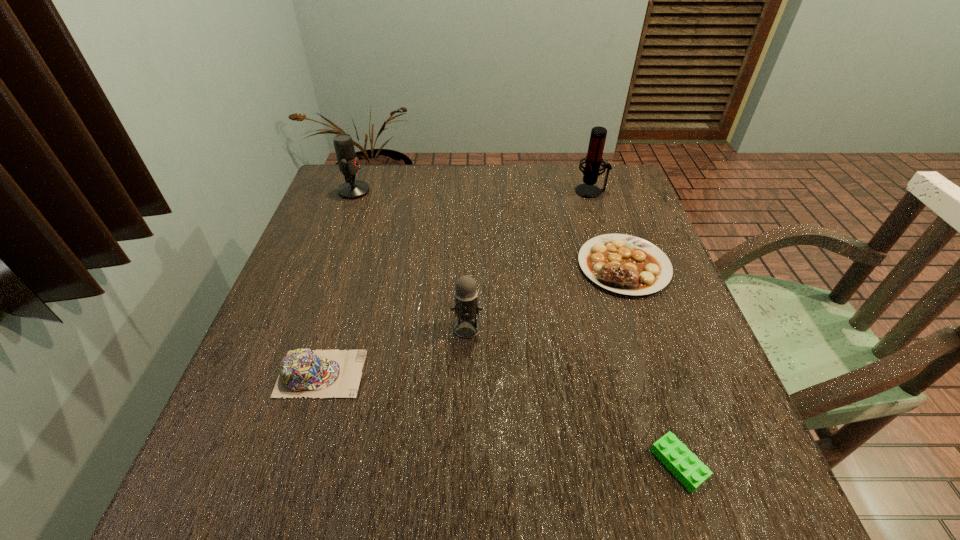
The height and width of the screenshot is (540, 960). I want to click on steak that is at the right edge, so coord(624,264).

Where is `Lego that is at the right edge`? Image resolution: width=960 pixels, height=540 pixels. Lego that is at the right edge is located at coordinates (680, 461).

Where is `object that is at the far left corner`? object that is at the far left corner is located at coordinates click(x=348, y=164).

Find the location of a particular element. object located in the far right corner section of the desktop is located at coordinates (593, 160).

Where is `object at the near right corner`? The image size is (960, 540). object at the near right corner is located at coordinates (680, 461).

This screenshot has height=540, width=960. Identify the location of vacant space at the far edge of the desktop. 552,206.

In order to click on vacant space at the near edge of the desktop in this screenshot , I will do `click(376, 487)`.

You are a GUI agent. You are given a task and a screenshot of the screen. Output one action in this format:
    pyautogui.click(x=<x>, y=<y>)
    Task: Click on the free region at the left edge
    This screenshot has width=960, height=540.
    Given the screenshot: What is the action you would take?
    247,410

Locate an element on the screen. This screenshot has width=960, height=540. blank space at the right edge of the desktop is located at coordinates (749, 450).

This screenshot has height=540, width=960. Identify the location of blank space at the far left corner of the desktop. (335, 186).